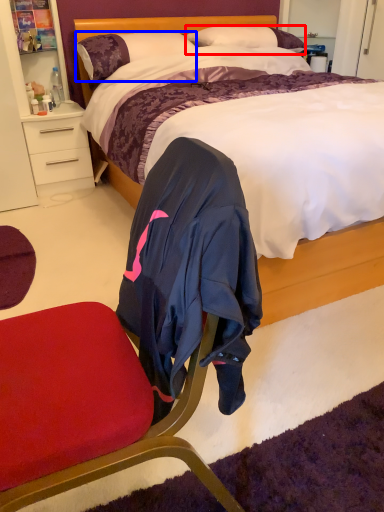
Question: Which object is further to the camera taking this photo, pillow (highlighted by a red box) or pillow (highlighted by a blue box)?

Choices:
 (A) pillow
 (B) pillow

Answer: (A)